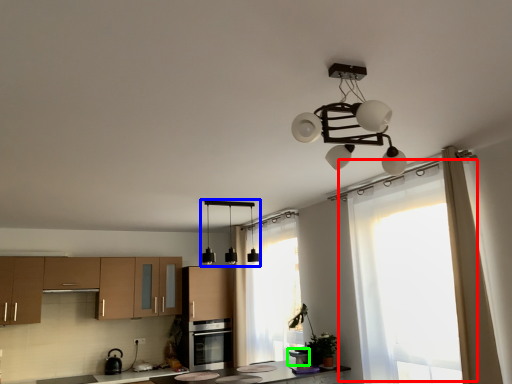
Question: Estimate the real-world distances between objects in this image. Which object is farther from window (highlighted by a red box), lamp (highlighted by a blue box) or appliance (highlighted by a green box)?

Choices:
 (A) lamp
 (B) appliance

Answer: (A)